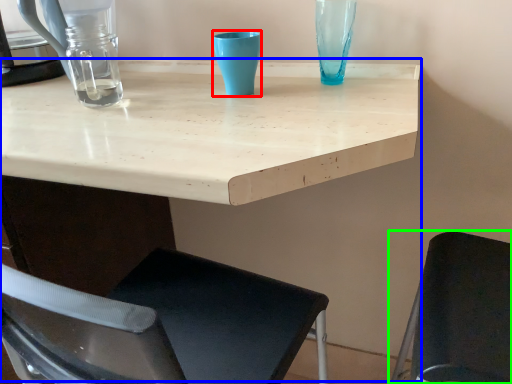
Question: Which object is the closest to the turquoise (highlighted by a red box)? Choose among these: table (highlighted by a blue box) or chair (highlighted by a green box).

Choices:
 (A) table
 (B) chair

Answer: (A)